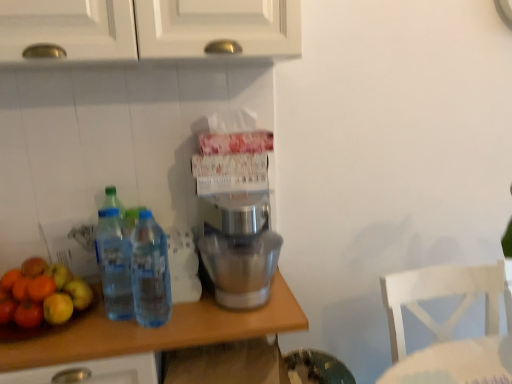
Question: Does shiny green apple at left appear on the left side of satin silver mixer at center?

Choices:
 (A) yes
 (B) no

Answer: (A)

Question: Is shiny green apple at left thinner than satin silver mixer at center?

Choices:
 (A) no
 (B) yes

Answer: (B)

Question: Is shiny green apple at left looking in the opposite direction of satin silver mixer at center?

Choices:
 (A) yes
 (B) no

Answer: (B)

Question: Does shiny green apple at left turn towards satin silver mixer at center?

Choices:
 (A) no
 (B) yes

Answer: (A)

Question: From the image's perspective, is shiny green apple at left on satin silver mixer at center?

Choices:
 (A) yes
 (B) no

Answer: (B)

Question: From their relative heights in the image, would you say transparent plastic bottles at left, the first bottle viewed from the left, is taller or shorter than clear wood countertop at center?

Choices:
 (A) short
 (B) tall

Answer: (A)

Question: Is transparent plastic bottles at left, the second bottle viewed from the right, inside the boundaries of clear wood countertop at center, or outside?

Choices:
 (A) inside
 (B) outside

Answer: (B)

Question: From the image's perspective, is transparent plastic bottles at left, the second bottle viewed from the right, positioned above or below clear wood countertop at center?

Choices:
 (A) above
 (B) below

Answer: (A)

Question: Is transparent plastic bottles at left, the second bottle viewed from the right, in front of or behind clear wood countertop at center in the image?

Choices:
 (A) behind
 (B) front

Answer: (A)

Question: In terms of height, does clear plastic bottles at center, arranged as the 2th bottle when viewed from the left, look taller or shorter compared to transparent plastic bottles at left, the second bottle viewed from the right?

Choices:
 (A) short
 (B) tall

Answer: (B)

Question: Based on their sizes in the image, would you say clear plastic bottles at center, the first bottle in the right-to-left sequence, is bigger or smaller than transparent plastic bottles at left, the second bottle viewed from the right?

Choices:
 (A) small
 (B) big

Answer: (B)

Question: Is clear plastic bottles at center, the first bottle in the right-to-left sequence, spatially inside transparent plastic bottles at left, the second bottle viewed from the right, or outside of it?

Choices:
 (A) inside
 (B) outside

Answer: (B)

Question: Considering the positions of point (140, 263) and point (114, 248), is point (140, 263) closer or farther from the camera than point (114, 248)?

Choices:
 (A) closer
 (B) farther

Answer: (A)

Question: In the image, is shiny green apple at left positioned in front of or behind white wooden chair at lower right?

Choices:
 (A) behind
 (B) front

Answer: (A)

Question: From the image's perspective, relative to white wooden chair at lower right, is shiny green apple at left above or below?

Choices:
 (A) below
 (B) above

Answer: (B)